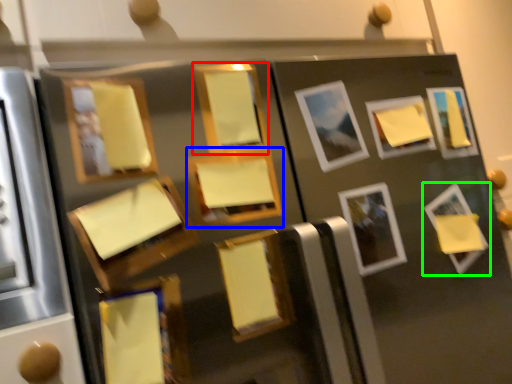
Question: Which object is positioned farthest from picture frame (highlighted by a red box)? Select from picture frame (highlighted by a blue box) and picture frame (highlighted by a green box).

Choices:
 (A) picture frame
 (B) picture frame

Answer: (B)